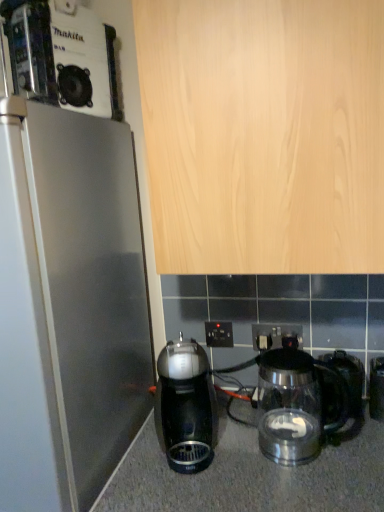
Question: Is metallic silver coffee maker at upper left wider than shiny black coffee maker at center, the first kitchen appliance from the left?

Choices:
 (A) yes
 (B) no

Answer: (A)

Question: Is metallic silver coffee maker at upper left not near shiny black coffee maker at center, the first kitchen appliance from the left?

Choices:
 (A) yes
 (B) no

Answer: (B)

Question: Would you say shiny black coffee maker at center, the second kitchen appliance in the right-to-left sequence, is part of metallic silver coffee maker at upper left's contents?

Choices:
 (A) yes
 (B) no

Answer: (B)

Question: Considering the relative sizes of metallic silver coffee maker at upper left and shiny black coffee maker at center, the first kitchen appliance from the left, in the image provided, is metallic silver coffee maker at upper left bigger than shiny black coffee maker at center, the first kitchen appliance from the left,?

Choices:
 (A) yes
 (B) no

Answer: (A)

Question: Could you tell me if metallic silver coffee maker at upper left is turned towards shiny black coffee maker at center, the second kitchen appliance in the right-to-left sequence?

Choices:
 (A) no
 (B) yes

Answer: (A)

Question: From a real-world perspective, does metallic silver coffee maker at upper left stand above shiny black coffee maker at center, the second kitchen appliance in the right-to-left sequence?

Choices:
 (A) yes
 (B) no

Answer: (A)

Question: Is black plastic kettle at lower right smaller than metallic silver coffee maker at upper left?

Choices:
 (A) no
 (B) yes

Answer: (B)

Question: Considering the relative sizes of black plastic kettle at lower right and metallic silver coffee maker at upper left in the image provided, is black plastic kettle at lower right taller than metallic silver coffee maker at upper left?

Choices:
 (A) no
 (B) yes

Answer: (A)

Question: Could you tell me if black plastic kettle at lower right is facing metallic silver coffee maker at upper left?

Choices:
 (A) no
 (B) yes

Answer: (A)

Question: Does black plastic kettle at lower right have a lesser height compared to metallic silver coffee maker at upper left?

Choices:
 (A) no
 (B) yes

Answer: (B)

Question: Is black plastic kettle at lower right thinner than metallic silver coffee maker at upper left?

Choices:
 (A) yes
 (B) no

Answer: (A)

Question: From the image's perspective, is black plastic kettle at lower right over metallic silver coffee maker at upper left?

Choices:
 (A) yes
 (B) no

Answer: (B)

Question: Is metallic silver coffee maker at upper left positioned beyond the bounds of black plastic electric outlet at center, the first electric outlet viewed from the left?

Choices:
 (A) no
 (B) yes

Answer: (B)